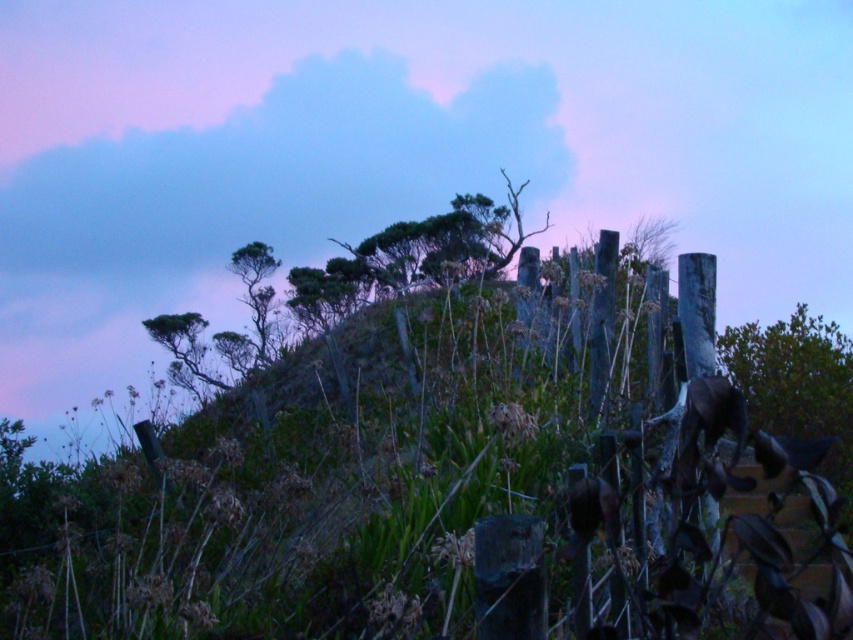
How far apart are green leafy tree at center and green leafy tree at upper center?

green leafy tree at center is 6.29 feet away from green leafy tree at upper center.

Which of these two, green leafy tree at center or green leafy tree at upper center, stands taller?

Standing taller between the two is green leafy tree at upper center.

Is point (166, 340) positioned behind point (262, 257)?

No, (166, 340) is in front of (262, 257).

Locate an element on the screen. The image size is (853, 640). green leafy tree at center is located at coordinates (184, 349).

Who is more distant from viewer, (845, 432) or (202, 376)?

The point (202, 376) is behind.

Does point (845, 397) lie in front of point (172, 346)?

Yes.

Find the location of a particular element. The width and height of the screenshot is (853, 640). green matte tree at right is located at coordinates (796, 381).

Can you confirm if green matte tree at right is wider than green leafy tree at upper center?

Indeed, green matte tree at right has a greater width compared to green leafy tree at upper center.

The height and width of the screenshot is (640, 853). In order to click on green matte tree at right in this screenshot , I will do `click(796, 381)`.